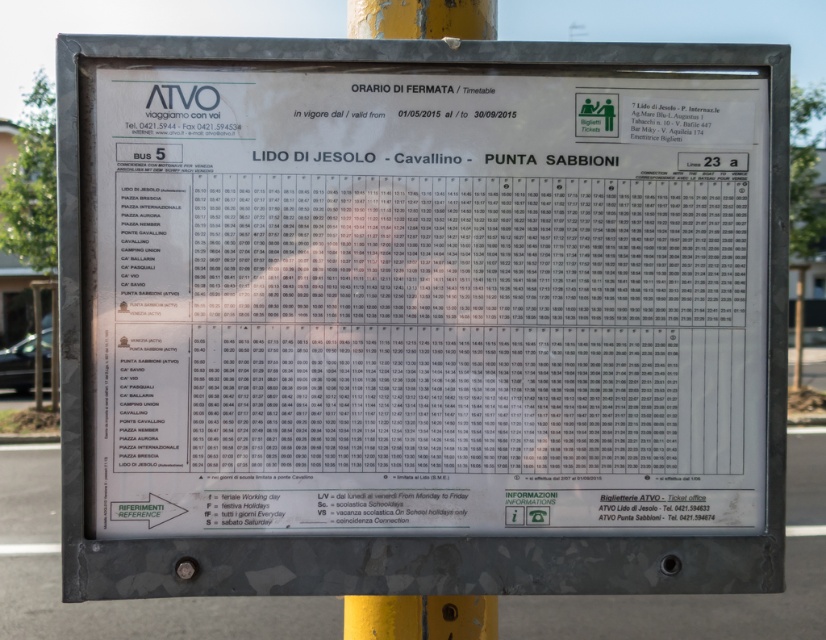
Is white paper timetable at center closer to the viewer compared to yellow painted metal pole at upper center?

That is True.

From the picture: Which is more to the left, white paper timetable at center or yellow painted metal pole at upper center?

Positioned to the left is yellow painted metal pole at upper center.

This screenshot has width=826, height=640. Find the location of `white paper timetable at center`. white paper timetable at center is located at coordinates (426, 301).